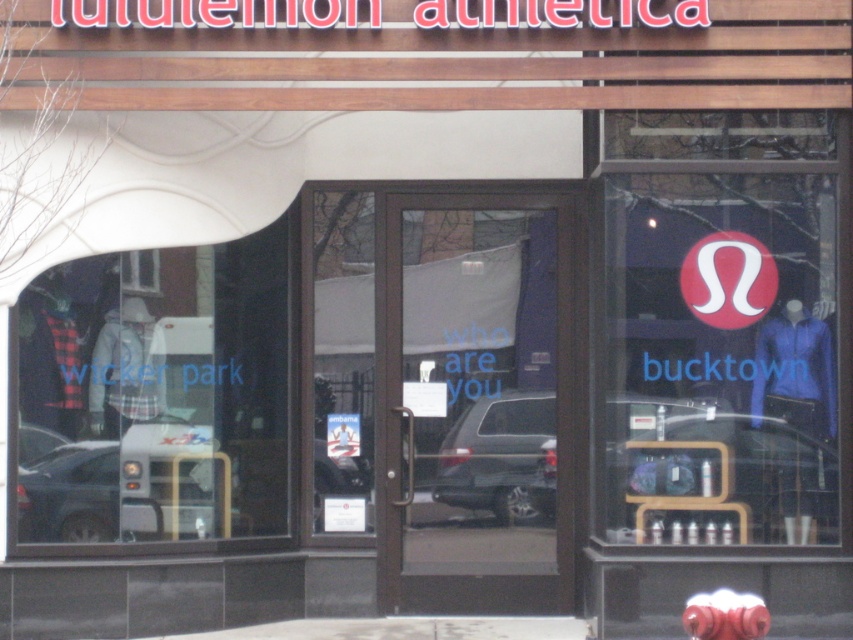
Is metallic silver bus at lower left above satin silver suv at center?

Actually, metallic silver bus at lower left is below satin silver suv at center.

Which is behind, point (21, 428) or point (549, 420)?

The point (549, 420) is more distant.

Does point (102, 465) come behind point (480, 403)?

No, it is in front of (480, 403).

This screenshot has height=640, width=853. What are the coordinates of `metallic silver bus at lower left` in the screenshot? It's located at click(120, 486).

Looking at this image, does matte black suv at center have a lesser height compared to rubberized red fire hydrant at lower center?

In fact, matte black suv at center may be taller than rubberized red fire hydrant at lower center.

Between point (688, 492) and point (717, 636), which one is positioned in front?

Point (717, 636) is more forward.

Where is `matte black suv at center`? matte black suv at center is located at coordinates (502, 458).

Which of these two, matte black suv at center or satin silver suv at center, stands shorter?

Standing shorter between the two is matte black suv at center.

Who is positioned more to the left, matte black suv at center or satin silver suv at center?

Positioned to the left is matte black suv at center.

What are the coordinates of `matte black suv at center` in the screenshot? It's located at (502, 458).